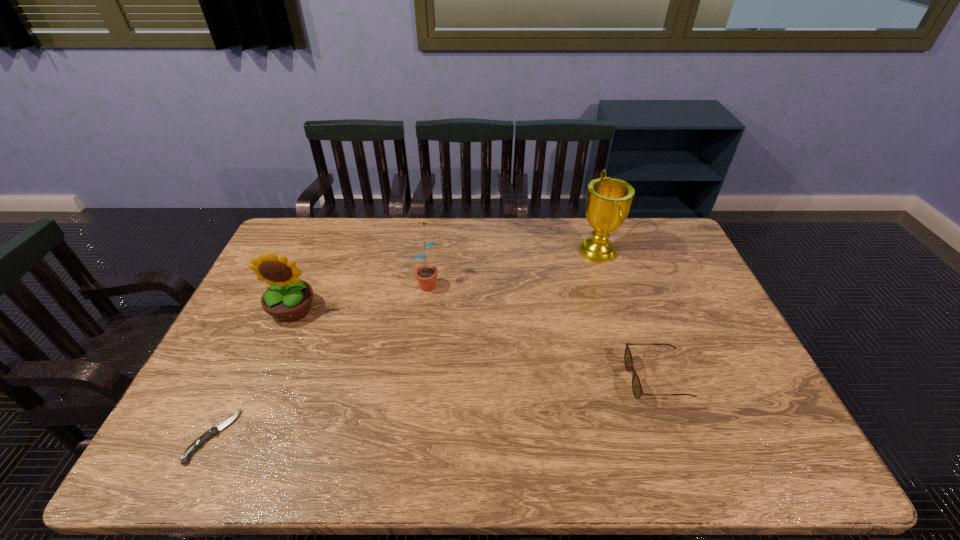
Where is `object that is at the near left corner`? The width and height of the screenshot is (960, 540). object that is at the near left corner is located at coordinates (214, 431).

Find the location of a particular element. The height and width of the screenshot is (540, 960). vacant region at the far edge of the desktop is located at coordinates 484,221.

At what (x,y) coordinates should I click in order to perform the action: click on free region at the near edge. Please return your answer as a coordinate pair (x, y). This screenshot has height=540, width=960. Looking at the image, I should click on (635, 440).

In order to click on vacant space at the left edge in this screenshot , I will do `click(243, 377)`.

What are the coordinates of `free space at the right edge of the desktop` in the screenshot? It's located at click(x=684, y=323).

The image size is (960, 540). Identify the location of vacant space at the far left corner of the desktop. (286, 233).

Locate an element on the screen. vacant space at the far right corner of the desktop is located at coordinates (640, 252).

Image resolution: width=960 pixels, height=540 pixels. Find the location of `free point between the shortest object and the left sunflower`. free point between the shortest object and the left sunflower is located at coordinates [252, 373].

Where is `free space between the spectacles and the shortest object`? free space between the spectacles and the shortest object is located at coordinates tap(434, 408).

You are a GUI agent. You are given a task and a screenshot of the screen. Output one action in this format:
    pyautogui.click(x=<x>, y=<y>)
    Task: Click on the free spot between the third object from right to left and the award
    This screenshot has width=960, height=540.
    Given the screenshot: What is the action you would take?
    pyautogui.click(x=513, y=267)